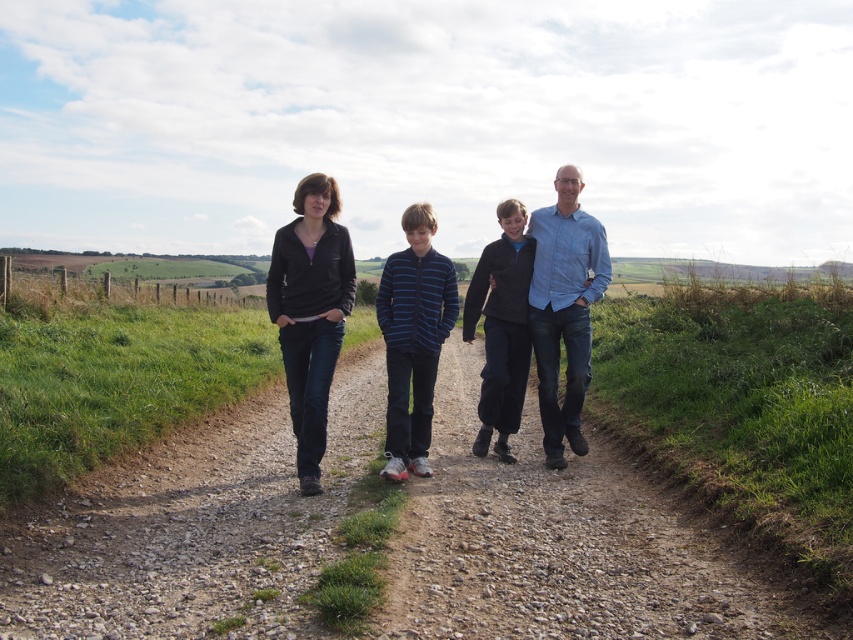
You are a photographer trying to capture a candid shot of the family walking. You notice the blue striped sweater at center and the dark blue fleece jacket at center. Which clothing item is positioned lower on the family members?

The blue striped sweater at center is located below dark blue fleece jacket at center, so the blue striped sweater at center is positioned lower.

You are a fashion designer observing the family walking along the path. You notice the dark blue jeans at center and the dark blue fleece jacket at center. Which clothing item is shorter in length?

The dark blue jeans at center is shorter than the dark blue fleece jacket at center.